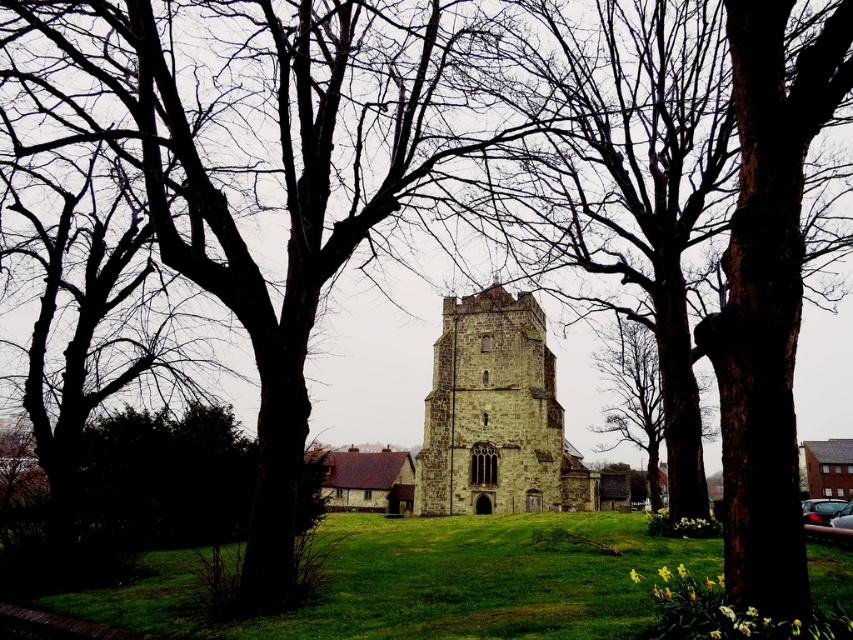
Question: Among these objects, which one is farthest from the camera?

Choices:
 (A) stone tower at center
 (B) brown rough bark tree at center

Answer: (A)

Question: Is stone tower at center further to camera compared to brown rough bark tree at center?

Choices:
 (A) yes
 (B) no

Answer: (A)

Question: Does stone tower at center have a larger size compared to brown rough bark tree at center?

Choices:
 (A) no
 (B) yes

Answer: (B)

Question: Which object appears farthest from the camera in this image?

Choices:
 (A) stone tower at center
 (B) brown rough bark tree at center
 (C) green grassy field at center

Answer: (A)

Question: Can you confirm if green grassy field at center is positioned above stone tower at center?

Choices:
 (A) no
 (B) yes

Answer: (A)

Question: Which object is positioned closest to the green grassy field at center?

Choices:
 (A) stone tower at center
 (B) brown rough bark tree at center

Answer: (A)